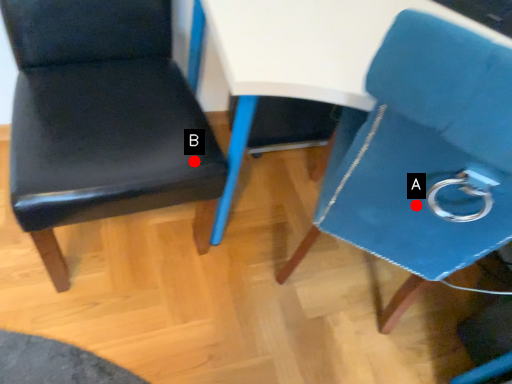
Question: Two points are circled on the image, labeled by A and B beside each circle. Which point is further to the camera?

Choices:
 (A) A is further
 (B) B is further

Answer: (B)